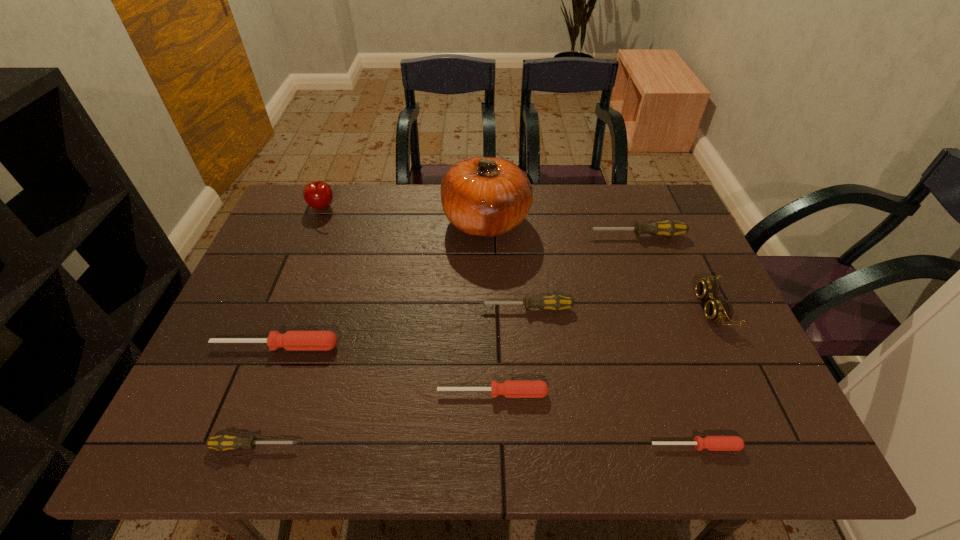
Where is `vacant space located 0.270m through the lenses of the goggles`? The width and height of the screenshot is (960, 540). vacant space located 0.270m through the lenses of the goggles is located at coordinates (593, 308).

The image size is (960, 540). I want to click on blank space located 0.050m at the tip of the sixth shortest object, so click(x=569, y=235).

Identify the location of blank space located at the tip of the sixth shortest object. (495, 235).

Find the location of a particular element. This screenshot has height=540, width=960. vacant region located 0.070m at the tip of the sixth shortest object is located at coordinates (563, 235).

Find the location of `blank space located 0.380m at the tip of the second gray screwdriver from left to right`. blank space located 0.380m at the tip of the second gray screwdriver from left to right is located at coordinates (330, 308).

The height and width of the screenshot is (540, 960). What are the coordinates of `vacant position located 0.350m at the tip of the second gray screwdriver from left to right` in the screenshot? It's located at (342, 308).

This screenshot has height=540, width=960. What are the coordinates of `free space located at the tip of the second gray screwdriver from left to right` in the screenshot? It's located at [350, 308].

Find the location of `vacant space located 0.100m on the front of the farthest red screwdriver`. vacant space located 0.100m on the front of the farthest red screwdriver is located at coordinates (258, 392).

Locate an element on the screen. The width and height of the screenshot is (960, 540). vacant space located on the back of the second nearest red screwdriver is located at coordinates (492, 352).

This screenshot has width=960, height=540. I want to click on vacant space situated at the tip of the smallest gray screwdriver, so click(x=486, y=446).